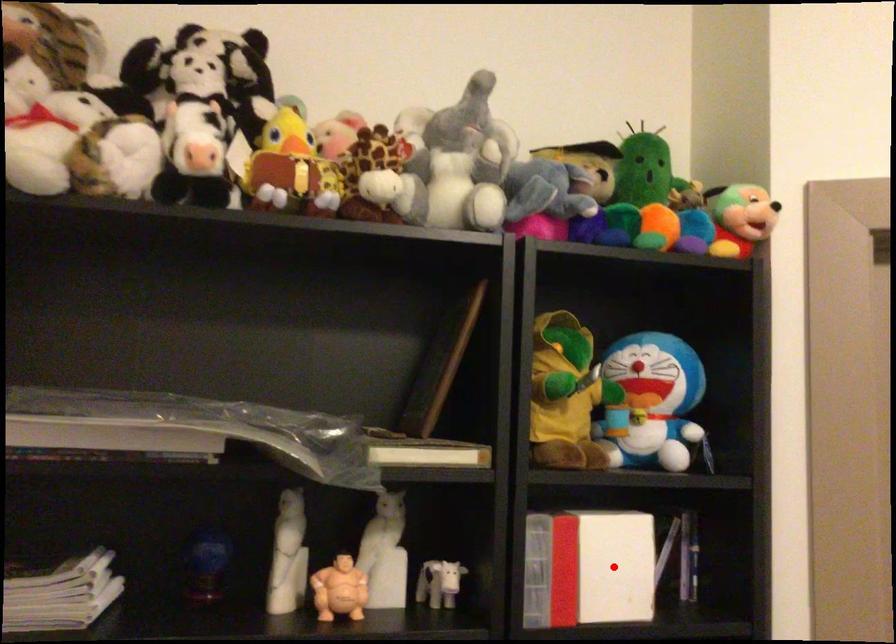
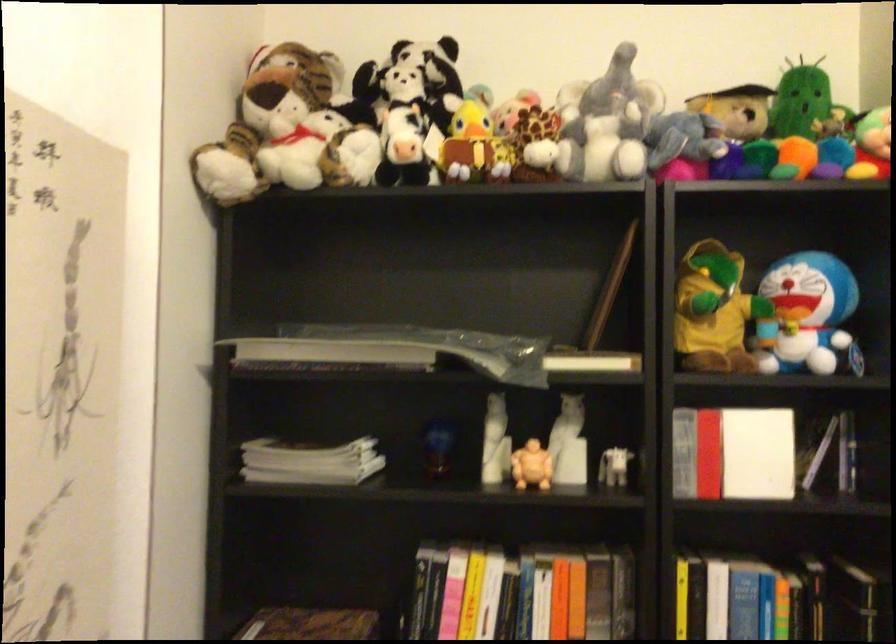
Find the pixel in the second image that matches the highlighted location in the first image.

(757, 453)